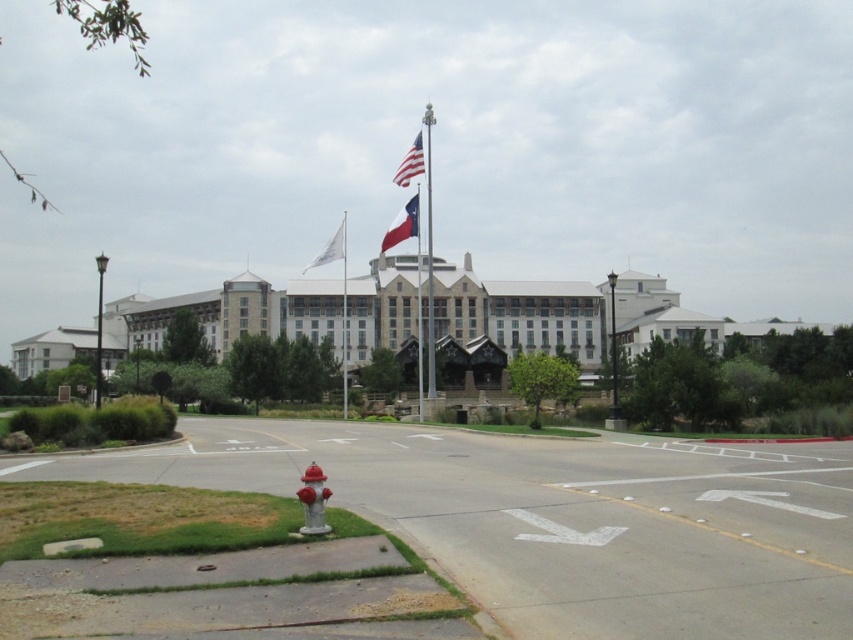
You are standing at the entrance of the large multi story building and want to find the metallic flag pole at center. According to the scene description, where should you look relative to the building?

The metallic flag pole at center is located at point (428, 257), which means it is positioned slightly to the right and halfway up the image from the bottom. Since you are at the entrance facing the building, you should look towards the center area slightly to the right of the building to find the metallic flag pole at center.

You are a maintenance worker who needs to replace the flags on both the metallic flag pole at center and the white fabric flagpole at center. If you have a ladder that can reach up to 20 meters, will you be able to reach both flagpoles?

The distance between the metallic flag pole at center and the white fabric flagpole at center is 21.88 meters. Since your ladder can only reach up to 20 meters, you won